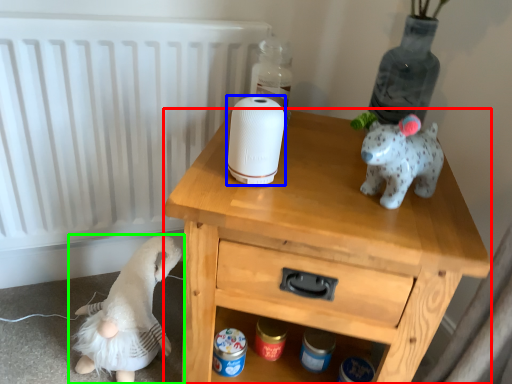
Question: Considering the real-world distances, which object is closest to nightstand (highlighted by a red box)? toilet paper (highlighted by a blue box) or toy (highlighted by a green box).

Choices:
 (A) toilet paper
 (B) toy

Answer: (A)